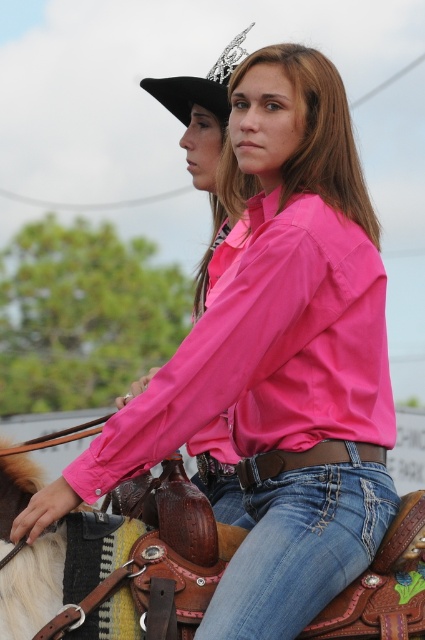
You are a photographer trying to capture a closeup of the brown leather saddle at lower center without the black felt cowboy hat at upper left blocking the view. Given their sizes, is the saddle small enough to fit within the frame without the hat overlapping?

The brown leather saddle at lower center has a lesser width compared to the black felt cowboy hat at upper left, so it is smaller in width. This means the saddle can likely fit within the frame without the hat overlapping, provided the camera angle and positioning are adjusted to exclude the hat.